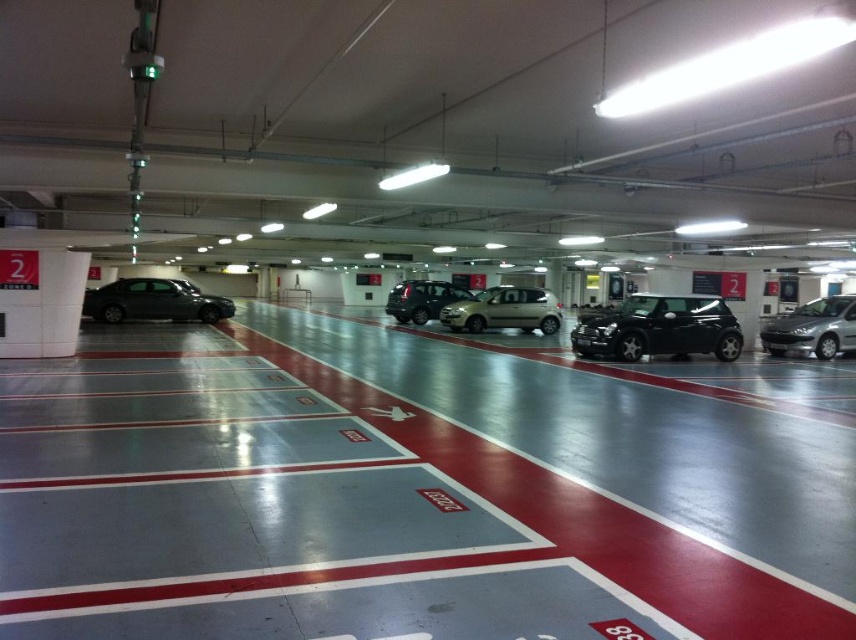
You are a parking attendant and need to ensure that all vehicles fit within their designated spaces. Given the glossy black car at center and the silver metallic hatchback at right, which vehicle requires a larger parking space?

The glossy black car at center requires a larger parking space because it is bigger than the silver metallic hatchback at right.

You are a parking attendant and need to locate the satin silver hatchback at center for a customer. Based on the coordinates provided in the scene description, can you confirm its exact position relative to the parking garage layout?

The satin silver hatchback at center is located at point coordinates of 0.486 in the x axis and 0.590 in the y axis. This places it centrally within the parking garage layout as described.

You are a parking attendant and need to direct a driver to park between the glossy black car at center and the satin black suv at center. Since both are parked at center, how do you ensure the driver knows the correct position?

The glossy black car at center is closer to the viewer than the satin black suv at center, so the driver should park between them by positioning their vehicle in the space between the closer glossy black car at center and the farther satin black suv at center.